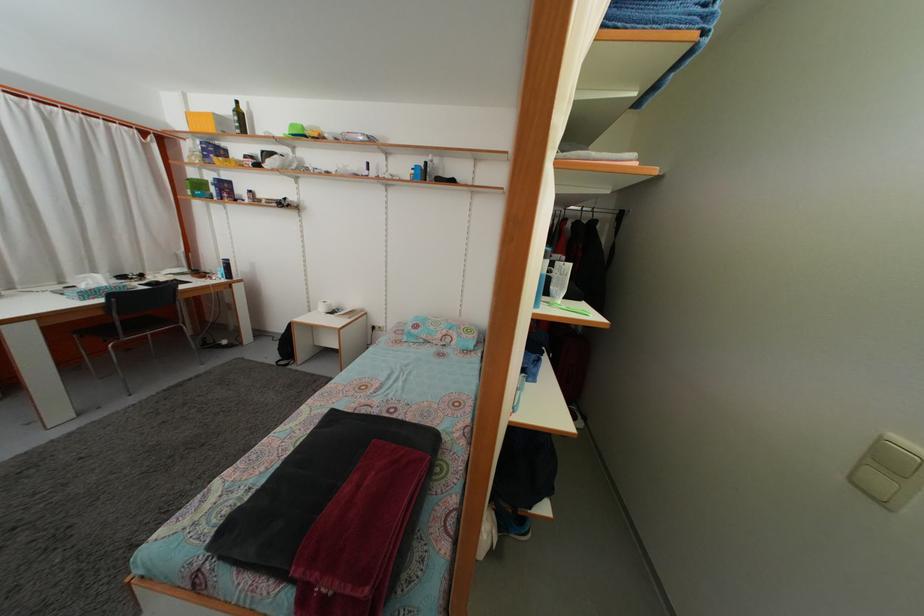
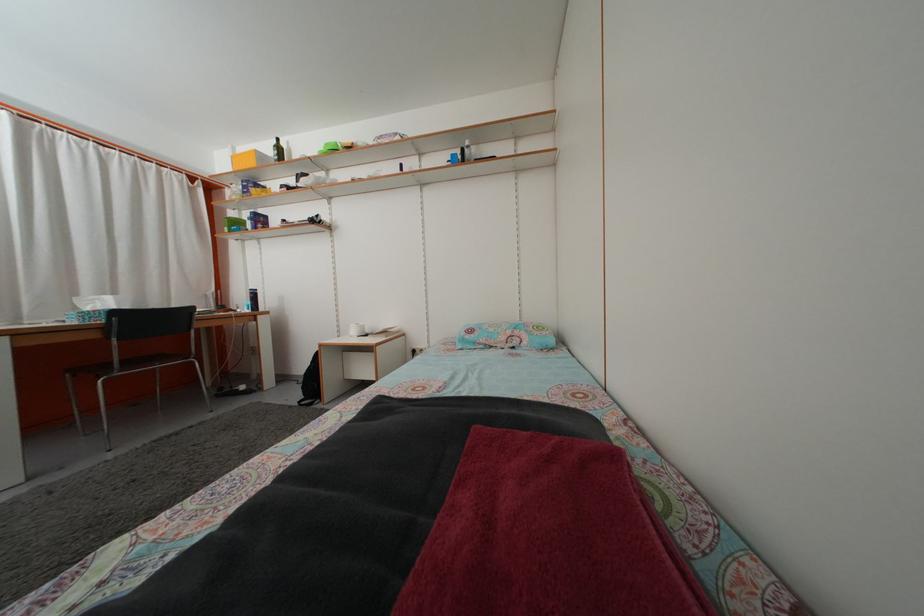
Question: I am providing you with two images of the same scene from different viewpoints. Please identify which objects are invisible in image2.

Choices:
 (A) blue tissue box
 (B) roll of paper
 (C) black water bottle
 (D) none of these

Answer: (D)